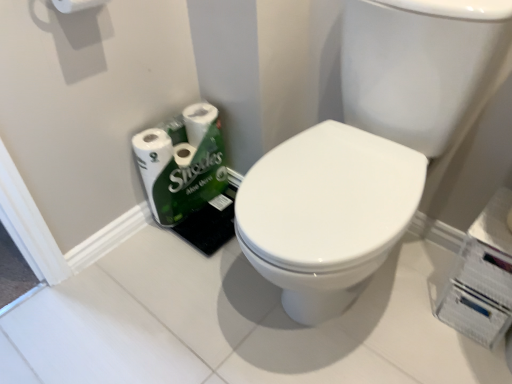
Question: From the image's perspective, is white glossy toilet paper at lower left, the second toilet paper positioned from the front, located beneath white matte toilet paper at upper left, which ranks as the 2th toilet paper in back-to-front order?

Choices:
 (A) no
 (B) yes

Answer: (B)

Question: From a real-world perspective, is white glossy toilet paper at lower left, which is counted as the second toilet paper, starting from the top, located beneath white matte toilet paper at upper left, positioned as the 1th toilet paper in top-to-bottom order?

Choices:
 (A) no
 (B) yes

Answer: (B)

Question: Does white glossy toilet paper at lower left, which is counted as the second toilet paper, starting from the top, have a larger size compared to white matte toilet paper at upper left, marked as the first toilet paper in a front-to-back arrangement?

Choices:
 (A) no
 (B) yes

Answer: (B)

Question: Is white matte toilet paper at upper left, which ranks as the 2th toilet paper in back-to-front order, a part of white glossy toilet paper at lower left, the second toilet paper positioned from the front?

Choices:
 (A) yes
 (B) no

Answer: (B)

Question: From the image's perspective, is white glossy toilet paper at lower left, the first toilet paper when ordered from back to front, on top of white matte toilet paper at upper left, arranged as the second toilet paper when ordered from the bottom?

Choices:
 (A) no
 (B) yes

Answer: (A)

Question: In terms of width, does white glossy sink at center look wider or thinner when compared to white glossy toilet paper at lower left, the second toilet paper positioned from the front?

Choices:
 (A) wide
 (B) thin

Answer: (A)

Question: Is white glossy sink at center spatially inside white glossy toilet paper at lower left, the second toilet paper positioned from the front, or outside of it?

Choices:
 (A) outside
 (B) inside

Answer: (A)

Question: Is point (508, 1) positioned closer to the camera than point (184, 147)?

Choices:
 (A) farther
 (B) closer

Answer: (B)

Question: Is white glossy sink at center to the left or to the right of white glossy toilet paper at lower left, arranged as the first toilet paper when ordered from the bottom, in the image?

Choices:
 (A) left
 (B) right

Answer: (B)

Question: Do you think white glossy sink at center is within white matte toilet paper at upper left, positioned as the 1th toilet paper in top-to-bottom order, or outside of it?

Choices:
 (A) inside
 (B) outside

Answer: (B)

Question: Considering the relative positions of white glossy sink at center and white matte toilet paper at upper left, marked as the first toilet paper in a front-to-back arrangement, in the image provided, is white glossy sink at center to the left or to the right of white matte toilet paper at upper left, marked as the first toilet paper in a front-to-back arrangement,?

Choices:
 (A) left
 (B) right

Answer: (B)

Question: In terms of height, does white glossy sink at center look taller or shorter compared to white matte toilet paper at upper left, marked as the first toilet paper in a front-to-back arrangement?

Choices:
 (A) short
 (B) tall

Answer: (B)

Question: Relative to white matte toilet paper at upper left, marked as the first toilet paper in a front-to-back arrangement, is white glossy sink at center in front or behind?

Choices:
 (A) front
 (B) behind

Answer: (A)

Question: In terms of width, does white matte toilet paper at upper left, which ranks as the 2th toilet paper in back-to-front order, look wider or thinner when compared to white glossy sink at center?

Choices:
 (A) thin
 (B) wide

Answer: (A)

Question: From the image's perspective, is white matte toilet paper at upper left, marked as the first toilet paper in a front-to-back arrangement, located above or below white glossy sink at center?

Choices:
 (A) below
 (B) above

Answer: (B)